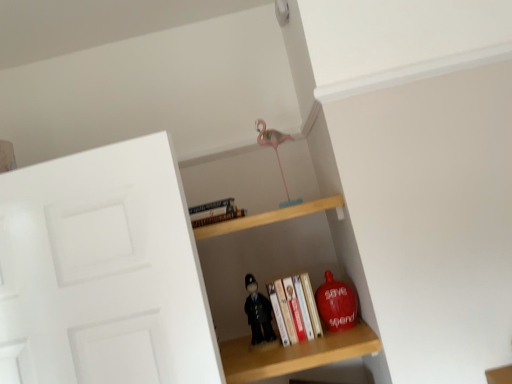
Question: Is wooden shelf at center, acting as the 1th shelf starting from the bottom, aimed at matte red piggy bank at lower right, the 1th toy in the right-to-left sequence?

Choices:
 (A) yes
 (B) no

Answer: (A)

Question: Does wooden shelf at center, which is the 2th shelf from top to bottom, have a lesser width compared to matte red piggy bank at lower right, the 1th toy in the right-to-left sequence?

Choices:
 (A) no
 (B) yes

Answer: (A)

Question: Does wooden shelf at center, acting as the 1th shelf starting from the bottom, touch matte red piggy bank at lower right, positioned as the 2th toy in top-to-bottom order?

Choices:
 (A) yes
 (B) no

Answer: (B)

Question: From the image's perspective, does wooden shelf at center, acting as the 1th shelf starting from the bottom, appear higher than matte red piggy bank at lower right, placed as the third toy when sorted from left to right?

Choices:
 (A) yes
 (B) no

Answer: (B)

Question: Is wooden shelf at center, which is the 2th shelf from top to bottom, positioned before matte red piggy bank at lower right, marked as the second toy in a bottom-to-top arrangement?

Choices:
 (A) yes
 (B) no

Answer: (A)

Question: In the image, is pink plastic flamingo at upper center, placed as the 1th toy when sorted from top to bottom, positioned in front of or behind black matte toy at center, placed as the third toy when sorted from right to left?

Choices:
 (A) behind
 (B) front

Answer: (A)

Question: Considering the positions of pink plastic flamingo at upper center, placed as the second toy when sorted from right to left, and black matte toy at center, which is counted as the 1th toy, starting from the left, in the image, is pink plastic flamingo at upper center, placed as the second toy when sorted from right to left, bigger or smaller than black matte toy at center, which is counted as the 1th toy, starting from the left,?

Choices:
 (A) big
 (B) small

Answer: (A)

Question: From a real-world perspective, is pink plastic flamingo at upper center, placed as the second toy when sorted from right to left, above or below black matte toy at center, which is counted as the first toy, starting from the bottom?

Choices:
 (A) above
 (B) below

Answer: (A)

Question: Considering the positions of pink plastic flamingo at upper center, placed as the second toy when sorted from right to left, and black matte toy at center, which ranks as the third toy in top-to-bottom order, in the image, is pink plastic flamingo at upper center, placed as the second toy when sorted from right to left, taller or shorter than black matte toy at center, which ranks as the third toy in top-to-bottom order,?

Choices:
 (A) tall
 (B) short

Answer: (A)

Question: From the image's perspective, relative to hardcover book at upper center, the second book viewed from the right, is wooden shelf at center, acting as the 1th shelf starting from the bottom, above or below?

Choices:
 (A) below
 (B) above

Answer: (A)

Question: Visually, is wooden shelf at center, which is the 2th shelf from top to bottom, positioned to the left or to the right of hardcover book at upper center, the 2th book when ordered from bottom to top?

Choices:
 (A) left
 (B) right

Answer: (B)

Question: Relative to hardcover book at upper center, marked as the 1th book in a top-to-bottom arrangement, is wooden shelf at center, acting as the 1th shelf starting from the bottom, in front or behind?

Choices:
 (A) behind
 (B) front

Answer: (B)

Question: Is wooden shelf at center, acting as the 1th shelf starting from the bottom, situated inside hardcover book at upper center, marked as the 1th book in a top-to-bottom arrangement, or outside?

Choices:
 (A) inside
 (B) outside

Answer: (B)

Question: Considering their positions, is pink plastic flamingo at upper center, placed as the second toy when sorted from right to left, located in front of or behind wooden shelf at upper center, placed as the 2th shelf when sorted from bottom to top?

Choices:
 (A) behind
 (B) front

Answer: (A)

Question: Considering the positions of pink plastic flamingo at upper center, placed as the 1th toy when sorted from top to bottom, and wooden shelf at upper center, placed as the 2th shelf when sorted from bottom to top, in the image, is pink plastic flamingo at upper center, placed as the 1th toy when sorted from top to bottom, taller or shorter than wooden shelf at upper center, placed as the 2th shelf when sorted from bottom to top,?

Choices:
 (A) tall
 (B) short

Answer: (A)